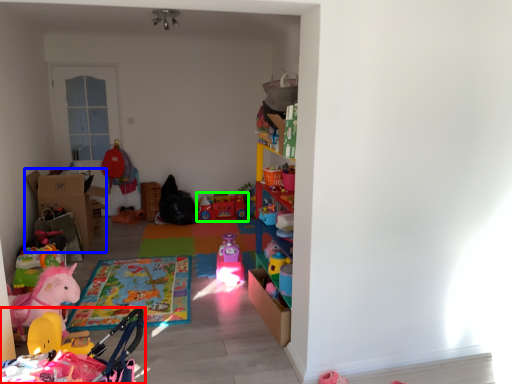
Question: Based on their relative distances, which object is farther from toy (highlighted by a red box)? Choose from cardboard box (highlighted by a blue box) and toy (highlighted by a green box).

Choices:
 (A) cardboard box
 (B) toy

Answer: (A)